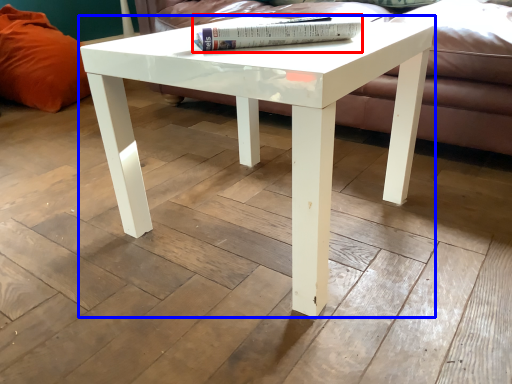
Question: Which object is further to the camera taking this photo, book (highlighted by a red box) or coffee table (highlighted by a blue box)?

Choices:
 (A) book
 (B) coffee table

Answer: (A)